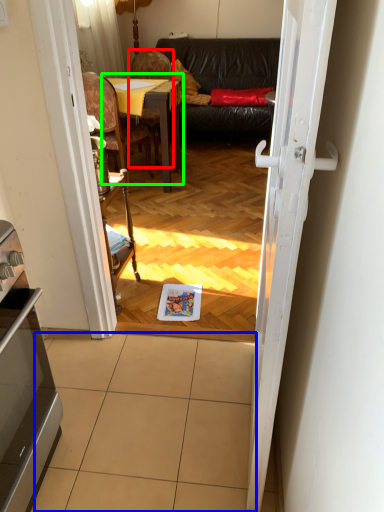
Question: Which object is positioned closest to chair (highlighted by a red box)? Select from tile (highlighted by a blue box) and table (highlighted by a green box).

Choices:
 (A) tile
 (B) table

Answer: (B)